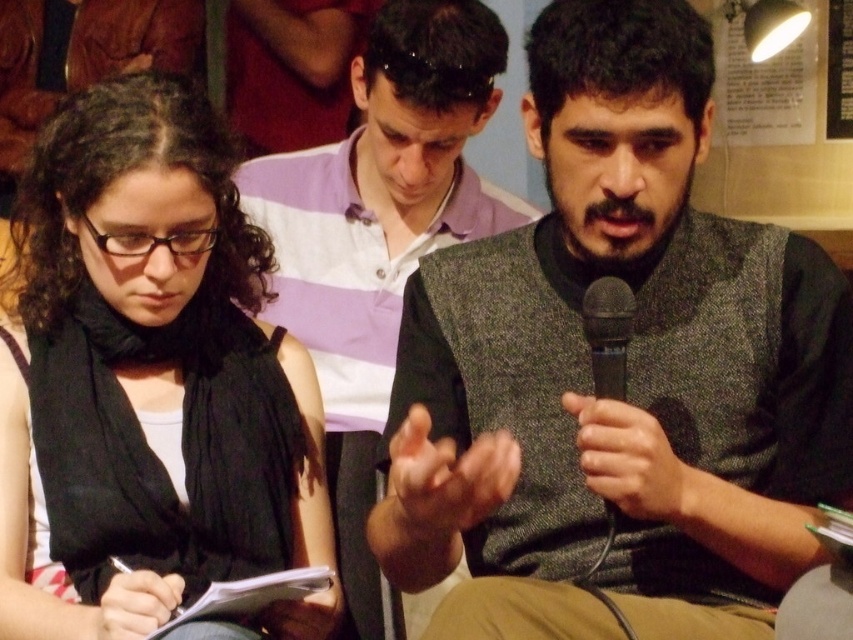
Question: Is dark gray textured vest at center positioned in front of black plastic microphone at right?

Choices:
 (A) no
 (B) yes

Answer: (B)

Question: Which point is closer to the camera taking this photo?

Choices:
 (A) (96, 618)
 (B) (631, 314)
 (C) (782, 316)
 (D) (465, 74)

Answer: (B)

Question: Which of the following is the closest to the observer?

Choices:
 (A) (393, 38)
 (B) (589, 289)
 (C) (582, 502)

Answer: (B)

Question: From the image, what is the correct spatial relationship of dark gray textured vest at center in relation to black fabric at left?

Choices:
 (A) left
 (B) right

Answer: (B)

Question: Which of the following is the farthest from the observer?

Choices:
 (A) (747, 612)
 (B) (612, 504)
 (C) (109, 140)
 (D) (405, 120)

Answer: (D)

Question: Is black fabric at left further to camera compared to striped cotton shirt at center?

Choices:
 (A) yes
 (B) no

Answer: (B)